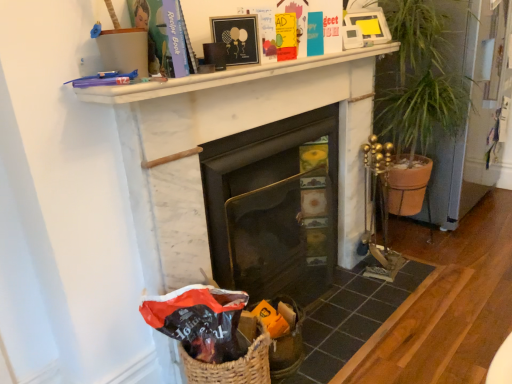
Describe the element at coordinates (237, 38) in the screenshot. The image size is (512, 384). I see `matte black picture frame at upper center` at that location.

What do you see at coordinates (228, 135) in the screenshot? I see `white marble fireplace at center, which is the 2th fireplace in left-to-right order` at bounding box center [228, 135].

What do you see at coordinates (271, 208) in the screenshot? I see `black glass fireplace at center, positioned as the 2th fireplace in right-to-left order` at bounding box center [271, 208].

What do you see at coordinates (223, 77) in the screenshot?
I see `white marble fireplace at upper center` at bounding box center [223, 77].

This screenshot has height=384, width=512. What do you see at coordinates (419, 78) in the screenshot?
I see `green leafy plant at right` at bounding box center [419, 78].

This screenshot has height=384, width=512. Find the location of `matte black picture frame at upper center`. matte black picture frame at upper center is located at coordinates (237, 38).

Is green leafy plant at right positioned behind matte black gift bag at lower left?

That is True.

From the image's perspective, is green leafy plant at right located above or below matte black gift bag at lower left?

From the image's perspective, green leafy plant at right appears above matte black gift bag at lower left.

In the scene shown: Is green leafy plant at right wider or thinner than matte black gift bag at lower left?

Clearly, green leafy plant at right has more width compared to matte black gift bag at lower left.

From the picture: Does black glass fireplace at center, the first fireplace in the left-to-right sequence, touch white marble fireplace at center, the first fireplace in the right-to-left sequence?

No, black glass fireplace at center, the first fireplace in the left-to-right sequence, is not next to white marble fireplace at center, the first fireplace in the right-to-left sequence.

In terms of height, does black glass fireplace at center, the first fireplace in the left-to-right sequence, look taller or shorter compared to white marble fireplace at center, which is the 2th fireplace in left-to-right order?

Clearly, black glass fireplace at center, the first fireplace in the left-to-right sequence, is shorter compared to white marble fireplace at center, which is the 2th fireplace in left-to-right order.

From a real-world perspective, is black glass fireplace at center, positioned as the 2th fireplace in right-to-left order, below white marble fireplace at center, the first fireplace in the right-to-left sequence?

Yes, from a real-world perspective, black glass fireplace at center, positioned as the 2th fireplace in right-to-left order, is under white marble fireplace at center, the first fireplace in the right-to-left sequence.

Looking at this image, is black glass fireplace at center, positioned as the 2th fireplace in right-to-left order, oriented away from white marble fireplace at center, which is the 2th fireplace in left-to-right order?

Yes, black glass fireplace at center, positioned as the 2th fireplace in right-to-left order, is facing away from white marble fireplace at center, which is the 2th fireplace in left-to-right order.

Does point (247, 44) appear closer or farther from the camera than point (256, 269)?

Point (247, 44).

Between matte black picture frame at upper center and black glass fireplace at center, positioned as the 2th fireplace in right-to-left order, which one appears on the right side from the viewer's perspective?

Positioned to the right is black glass fireplace at center, positioned as the 2th fireplace in right-to-left order.

Is matte black picture frame at upper center not near black glass fireplace at center, the first fireplace in the left-to-right sequence?

They are positioned close to each other.

In the image, is matte black picture frame at upper center positioned in front of or behind black glass fireplace at center, positioned as the 2th fireplace in right-to-left order?

Clearly, matte black picture frame at upper center is in front of black glass fireplace at center, positioned as the 2th fireplace in right-to-left order.

Could you tell me if white marble fireplace at upper center is turned towards matte black picture frame at upper center?

No, white marble fireplace at upper center does not turn towards matte black picture frame at upper center.

Does white marble fireplace at upper center come behind matte black picture frame at upper center?

No, white marble fireplace at upper center is in front of matte black picture frame at upper center.

Locate an element on the screen. The width and height of the screenshot is (512, 384). picture frame located behind the white marble fireplace at upper center is located at coordinates (237, 38).

How far apart are white marble fireplace at upper center and matte black picture frame at upper center?

The distance of white marble fireplace at upper center from matte black picture frame at upper center is 7.68 inches.

Visually, is matte black gift bag at lower left positioned to the left or to the right of white marble fireplace at center, which is the 2th fireplace in left-to-right order?

matte black gift bag at lower left is positioned on white marble fireplace at center, which is the 2th fireplace in left-to-right order,'s left side.

Who is shorter, matte black gift bag at lower left or white marble fireplace at center, which is the 2th fireplace in left-to-right order?

matte black gift bag at lower left is shorter.

From the image's perspective, is matte black gift bag at lower left beneath white marble fireplace at center, which is the 2th fireplace in left-to-right order?

Yes.

In the scene shown: Are matte black gift bag at lower left and white marble fireplace at center, the first fireplace in the right-to-left sequence, making contact?

No, matte black gift bag at lower left is not in contact with white marble fireplace at center, the first fireplace in the right-to-left sequence.

Considering the sizes of white marble fireplace at center, which is the 2th fireplace in left-to-right order, and black glass fireplace at center, the first fireplace in the left-to-right sequence, in the image, is white marble fireplace at center, which is the 2th fireplace in left-to-right order, taller or shorter than black glass fireplace at center, the first fireplace in the left-to-right sequence,?

Clearly, white marble fireplace at center, which is the 2th fireplace in left-to-right order, is taller compared to black glass fireplace at center, the first fireplace in the left-to-right sequence.

From the image's perspective, which is above, white marble fireplace at center, the first fireplace in the right-to-left sequence, or black glass fireplace at center, positioned as the 2th fireplace in right-to-left order?

white marble fireplace at center, the first fireplace in the right-to-left sequence, is shown above in the image.

Is point (347, 95) closer to camera compared to point (222, 203)?

No, it is behind (222, 203).

From a real-world perspective, is white marble fireplace at center, the first fireplace in the right-to-left sequence, on black glass fireplace at center, positioned as the 2th fireplace in right-to-left order?

Yes.

Looking at this image, looking at their sizes, would you say matte black picture frame at upper center is wider or thinner than white marble fireplace at center, the first fireplace in the right-to-left sequence?

Clearly, matte black picture frame at upper center has less width compared to white marble fireplace at center, the first fireplace in the right-to-left sequence.

Considering the positions of objects matte black picture frame at upper center and white marble fireplace at center, the first fireplace in the right-to-left sequence, in the image provided, who is more to the right, matte black picture frame at upper center or white marble fireplace at center, the first fireplace in the right-to-left sequence,?

white marble fireplace at center, the first fireplace in the right-to-left sequence, is more to the right.

From a real-world perspective, between matte black picture frame at upper center and white marble fireplace at center, the first fireplace in the right-to-left sequence, who is vertically higher?

matte black picture frame at upper center is physically above.

Is the depth of matte black picture frame at upper center less than that of white marble fireplace at center, the first fireplace in the right-to-left sequence?

No, matte black picture frame at upper center is further to the viewer.

You are a GUI agent. You are given a task and a screenshot of the screen. Output one action in this format:
    pyautogui.click(x=<x>, y=<y>)
    Task: Click on the plant that appears above the matte black gift bag at lower left (from the image's perspective)
    
    Given the screenshot: What is the action you would take?
    pyautogui.click(x=419, y=78)

You are a GUI agent. You are given a task and a screenshot of the screen. Output one action in this format:
    pyautogui.click(x=<x>, y=<y>)
    Task: Click on the fireplace lying on the left of white marble fireplace at center, the first fireplace in the right-to-left sequence
    The width and height of the screenshot is (512, 384).
    Given the screenshot: What is the action you would take?
    pyautogui.click(x=271, y=208)

Considering their positions, is black glass fireplace at center, positioned as the 2th fireplace in right-to-left order, positioned closer to matte black gift bag at lower left than green leafy plant at right?

black glass fireplace at center, positioned as the 2th fireplace in right-to-left order, lies closer to matte black gift bag at lower left than the other object.

Which object lies nearer to the anchor point matte black gift bag at lower left, white marble fireplace at center, which is the 2th fireplace in left-to-right order, or black glass fireplace at center, the first fireplace in the left-to-right sequence?

white marble fireplace at center, which is the 2th fireplace in left-to-right order, is closer to matte black gift bag at lower left.

Which object lies further to the anchor point green leafy plant at right, matte black gift bag at lower left or black glass fireplace at center, the first fireplace in the left-to-right sequence?

matte black gift bag at lower left lies further to green leafy plant at right than the other object.

Which object lies nearer to the anchor point matte black gift bag at lower left, green leafy plant at right or black glass fireplace at center, the first fireplace in the left-to-right sequence?

black glass fireplace at center, the first fireplace in the left-to-right sequence, lies closer to matte black gift bag at lower left than the other object.

From the image, which object appears to be nearer to green leafy plant at right, matte black picture frame at upper center or black glass fireplace at center, positioned as the 2th fireplace in right-to-left order?

Based on the image, black glass fireplace at center, positioned as the 2th fireplace in right-to-left order, appears to be nearer to green leafy plant at right.

From the image, which object appears to be farther from matte black picture frame at upper center, matte black gift bag at lower left or white marble fireplace at upper center?

matte black gift bag at lower left is positioned further to the anchor matte black picture frame at upper center.

Looking at the image, which one is located further to green leafy plant at right, black glass fireplace at center, the first fireplace in the left-to-right sequence, or white marble fireplace at center, the first fireplace in the right-to-left sequence?

black glass fireplace at center, the first fireplace in the left-to-right sequence, is further to green leafy plant at right.

Based on the photo, based on their spatial positions, is white marble fireplace at upper center or matte black picture frame at upper center further from white marble fireplace at center, which is the 2th fireplace in left-to-right order?

matte black picture frame at upper center lies further to white marble fireplace at center, which is the 2th fireplace in left-to-right order, than the other object.

Find the location of a particular element. picture frame between white marble fireplace at upper center and black glass fireplace at center, the first fireplace in the left-to-right sequence, in the up-down direction is located at coordinates (237, 38).

Identify the location of picture frame between white marble fireplace at upper center and matte black gift bag at lower left from top to bottom. (237, 38).

At what (x,y) coordinates should I click in order to perform the action: click on fireplace situated between black glass fireplace at center, the first fireplace in the left-to-right sequence, and green leafy plant at right from left to right. Please return your answer as a coordinate pair (x, y). This screenshot has height=384, width=512. Looking at the image, I should click on (228, 135).

Locate an element on the screen. picture frame between matte black gift bag at lower left and green leafy plant at right is located at coordinates (237, 38).